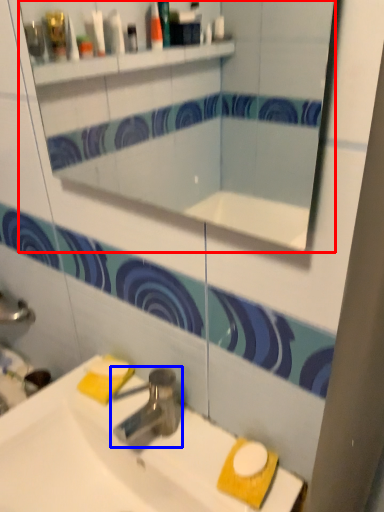
Question: Which object is further to the camera taking this photo, mirror (highlighted by a red box) or tap (highlighted by a blue box)?

Choices:
 (A) mirror
 (B) tap

Answer: (B)